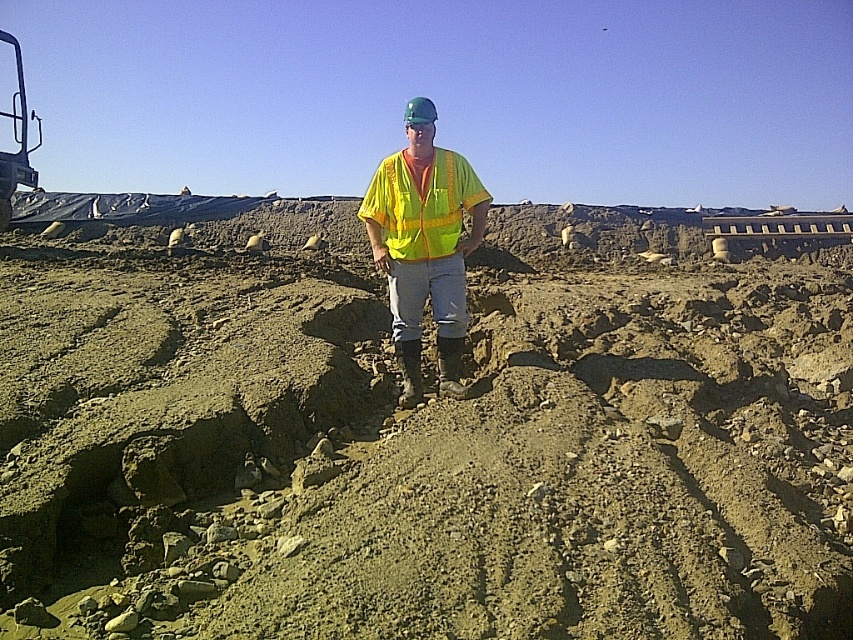
Can you confirm if dull brown dirt at center is bigger than yellow reflective vest at center?

Yes, dull brown dirt at center is bigger than yellow reflective vest at center.

Which of these two, dull brown dirt at center or yellow reflective vest at center, stands shorter?

Standing shorter between the two is yellow reflective vest at center.

Who is more distant from viewer, (561, 483) or (432, 132)?

The point (432, 132) is behind.

Locate an element on the screen. This screenshot has height=640, width=853. dull brown dirt at center is located at coordinates (421, 438).